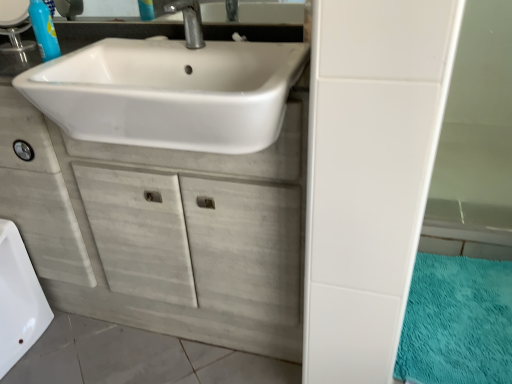
Question: Can you confirm if white glossy bath at lower left is positioned to the right of white glossy sink at upper center?

Choices:
 (A) yes
 (B) no

Answer: (B)

Question: Is the depth of white glossy bath at lower left less than that of white glossy sink at upper center?

Choices:
 (A) no
 (B) yes

Answer: (A)

Question: Could white glossy sink at upper center be considered to be inside white glossy bath at lower left?

Choices:
 (A) yes
 (B) no

Answer: (B)

Question: Is white glossy bath at lower left turned away from white glossy sink at upper center?

Choices:
 (A) yes
 (B) no

Answer: (B)

Question: Can you confirm if white glossy bath at lower left is wider than white glossy sink at upper center?

Choices:
 (A) yes
 (B) no

Answer: (B)

Question: Based on their positions, is white wood cabinet at center located to the left or right of metallic silver faucet at upper center?

Choices:
 (A) left
 (B) right

Answer: (A)

Question: Considering the positions of white wood cabinet at center and metallic silver faucet at upper center in the image, is white wood cabinet at center wider or thinner than metallic silver faucet at upper center?

Choices:
 (A) wide
 (B) thin

Answer: (A)

Question: From the image's perspective, relative to metallic silver faucet at upper center, is white wood cabinet at center above or below?

Choices:
 (A) above
 (B) below

Answer: (B)

Question: Relative to metallic silver faucet at upper center, is white wood cabinet at center in front or behind?

Choices:
 (A) front
 (B) behind

Answer: (A)

Question: Considering their positions, is blue plastic soap dispenser at upper left located in front of or behind metallic silver faucet at upper center?

Choices:
 (A) front
 (B) behind

Answer: (B)

Question: From a real-world perspective, is blue plastic soap dispenser at upper left physically located above or below metallic silver faucet at upper center?

Choices:
 (A) below
 (B) above

Answer: (A)

Question: From the image's perspective, is blue plastic soap dispenser at upper left positioned above or below metallic silver faucet at upper center?

Choices:
 (A) below
 (B) above

Answer: (B)

Question: Considering the relative positions of blue plastic soap dispenser at upper left and metallic silver faucet at upper center in the image provided, is blue plastic soap dispenser at upper left to the left or to the right of metallic silver faucet at upper center?

Choices:
 (A) left
 (B) right

Answer: (A)

Question: Looking at the image, does blue plastic soap dispenser at upper left seem bigger or smaller compared to teal plush bath mat at lower right?

Choices:
 (A) small
 (B) big

Answer: (A)

Question: In terms of height, does blue plastic soap dispenser at upper left look taller or shorter compared to teal plush bath mat at lower right?

Choices:
 (A) short
 (B) tall

Answer: (B)